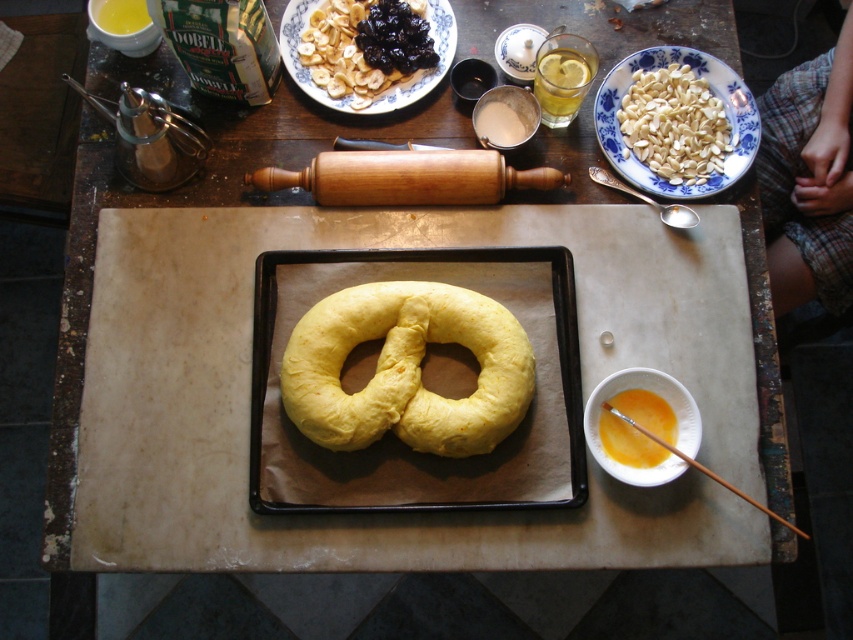
In order to click on yellow doughnut at center in this screenshot , I will do `click(405, 369)`.

Between yellow doughnut at center and orange liquid at center, which one has less height?

orange liquid at center

Find the location of a particular element. Image resolution: width=853 pixels, height=640 pixels. yellow doughnut at center is located at coordinates (405, 369).

Measure the distance between white smooth almonds at upper right and orange liquid at center.

The distance of white smooth almonds at upper right from orange liquid at center is 13.62 inches.

Can you confirm if white smooth almonds at upper right is shorter than orange liquid at center?

In fact, white smooth almonds at upper right may be taller than orange liquid at center.

Locate an element on the screen. The width and height of the screenshot is (853, 640). white smooth almonds at upper right is located at coordinates (674, 124).

Is shiny brown nuts at center positioned at the back of white smooth almonds at upper right?

Yes, it is behind white smooth almonds at upper right.

Between shiny brown nuts at center and white smooth almonds at upper right, which one appears on the right side from the viewer's perspective?

From the viewer's perspective, white smooth almonds at upper right appears more on the right side.

Is point (397, 4) positioned in front of point (717, 168)?

No, it is not.

Locate an element on the screen. This screenshot has height=640, width=853. shiny brown nuts at center is located at coordinates (340, 54).